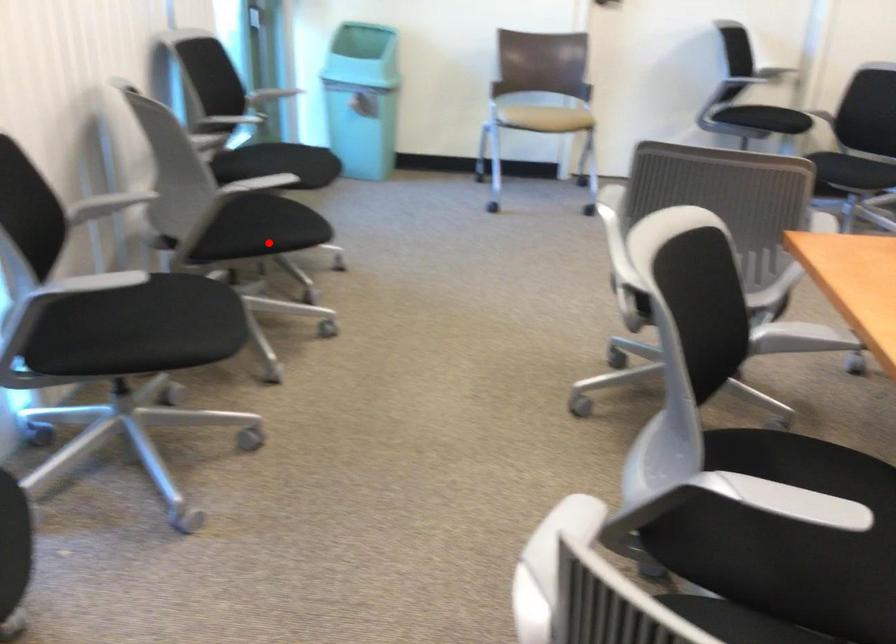
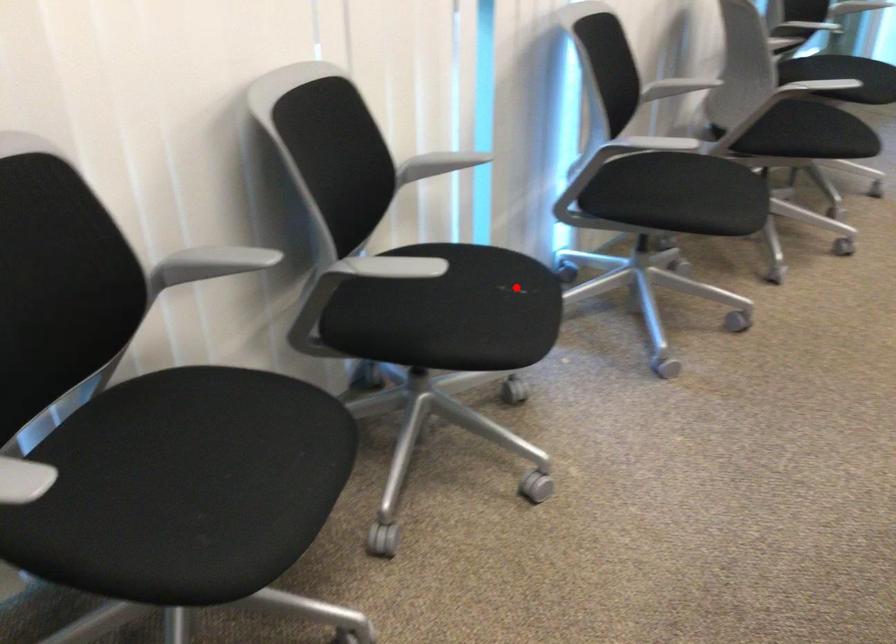
I am providing you with two images of the same scene from different viewpoints. A red point is marked on the first image and another point is marked on the second image. Do the highlighted points in image1 and image2 indicate the same real-world spot?

No